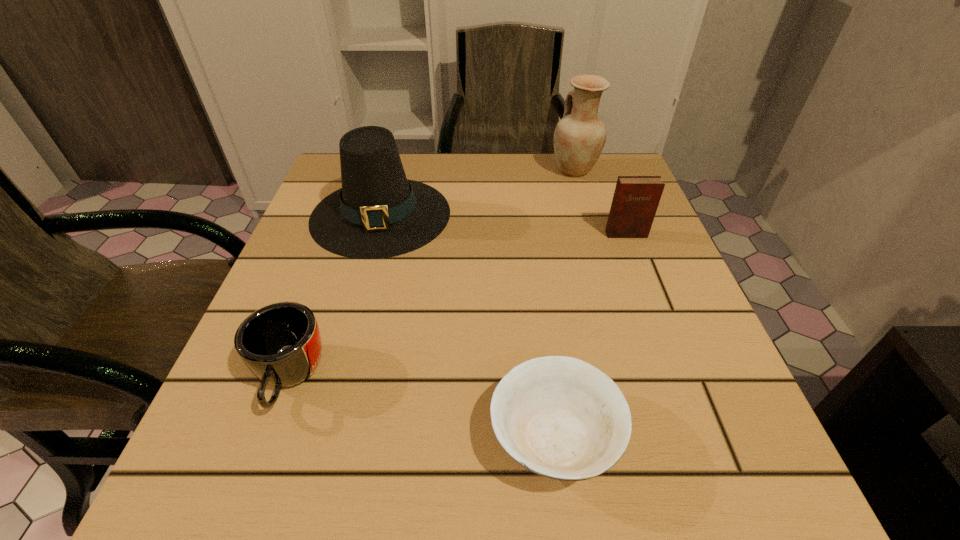
Where is `pottery`? The image size is (960, 540). pottery is located at coordinates (579, 137).

What are the coordinates of `hat` in the screenshot? It's located at (378, 213).

Where is `the third shortest object`? The image size is (960, 540). the third shortest object is located at coordinates (636, 198).

At what (x,y) coordinates should I click in order to perform the action: click on the fourth tallest object. Please return your answer as a coordinate pair (x, y). The width and height of the screenshot is (960, 540). Looking at the image, I should click on (280, 343).

Find the location of a particular element. bowl is located at coordinates (559, 417).

The image size is (960, 540). In order to click on vacant space positioned 0.220m on the front of the tallest object in this screenshot , I will do `click(596, 242)`.

Locate an element on the screen. free space located on the front-facing side of the fourth shortest object is located at coordinates (353, 314).

At what (x,y) coordinates should I click in order to perform the action: click on vacant space situated on the front cover of the third shortest object. Please return your answer as a coordinate pair (x, y). Looking at the image, I should click on (640, 272).

The height and width of the screenshot is (540, 960). In order to click on free region located on the side of the second shortest object with the handle in this screenshot , I will do `click(248, 491)`.

The image size is (960, 540). Find the location of `vacant space situated 0.060m on the back of the bowl`. vacant space situated 0.060m on the back of the bowl is located at coordinates (542, 348).